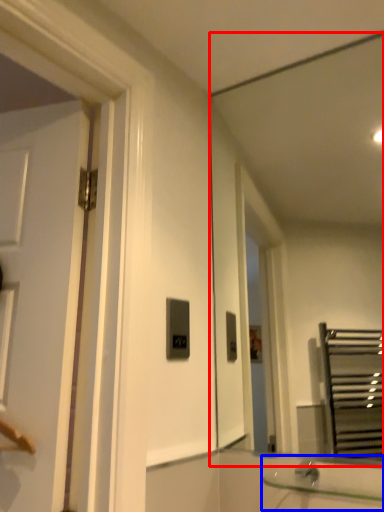
Question: Among these objects, which one is farthest to the camera, mirror (highlighted by a red box) or sink (highlighted by a blue box)?

Choices:
 (A) mirror
 (B) sink

Answer: (A)